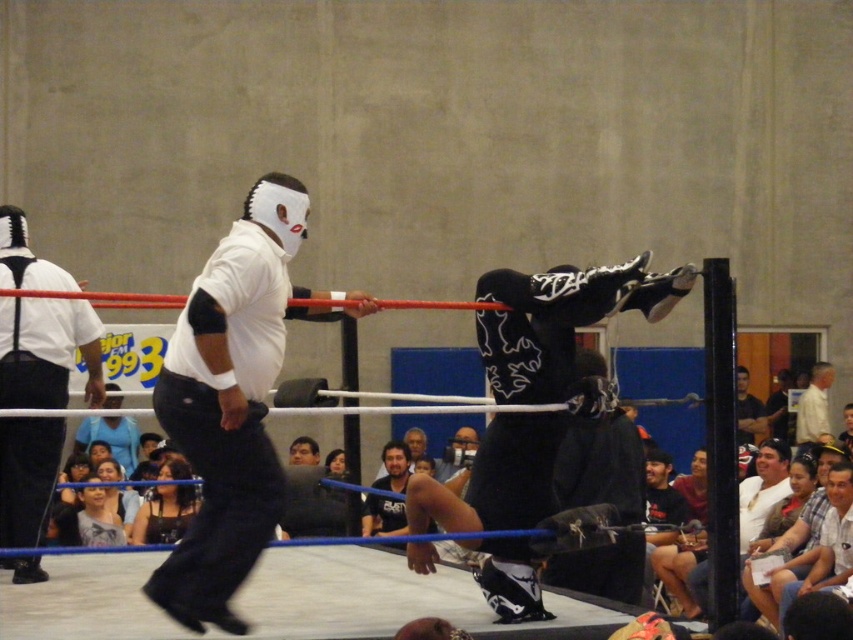
You are a photographer at the wrestling match and need to capture a closeup shot of the white matte mask at upper center without the dark blue jeans at center being visible in the frame. Is this possible based on their positions?

The white matte mask at upper center is positioned over the dark blue jeans at center, meaning the mask is directly above the jeans. Since they are vertically aligned, adjusting the camera angle to focus solely on the mask while excluding the jeans below should be feasible.

You are a photographer standing at the edge of the wrestling ring. You need to capture a photo of the black fabric dress at lower left and the light blue fabric at lower left. Which fabric is wider in the image?

The light blue fabric at lower left is wider than the black fabric dress at lower left.